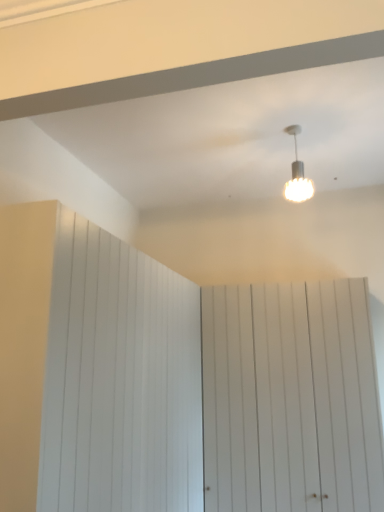
Question: In terms of width, does white wood barn door at center, the first barn door in the right-to-left sequence, look wider or thinner when compared to white wood barn door at left, which appears as the 1th barn door when viewed from the left?

Choices:
 (A) wide
 (B) thin

Answer: (B)

Question: Relative to white wood barn door at left, which appears as the second barn door when viewed from the right, is white wood barn door at center, the first barn door in the right-to-left sequence, in front or behind?

Choices:
 (A) behind
 (B) front

Answer: (A)

Question: Which is farther from the white wood barn door at center, the first barn door in the right-to-left sequence?

Choices:
 (A) white textured lamp at upper center
 (B) white wood barn door at left, which appears as the 1th barn door when viewed from the left

Answer: (A)

Question: Based on their relative distances, which object is farther from the white wood barn door at center, acting as the 2th barn door starting from the left?

Choices:
 (A) white wood barn door at left, which appears as the second barn door when viewed from the right
 (B) white textured lamp at upper center

Answer: (B)